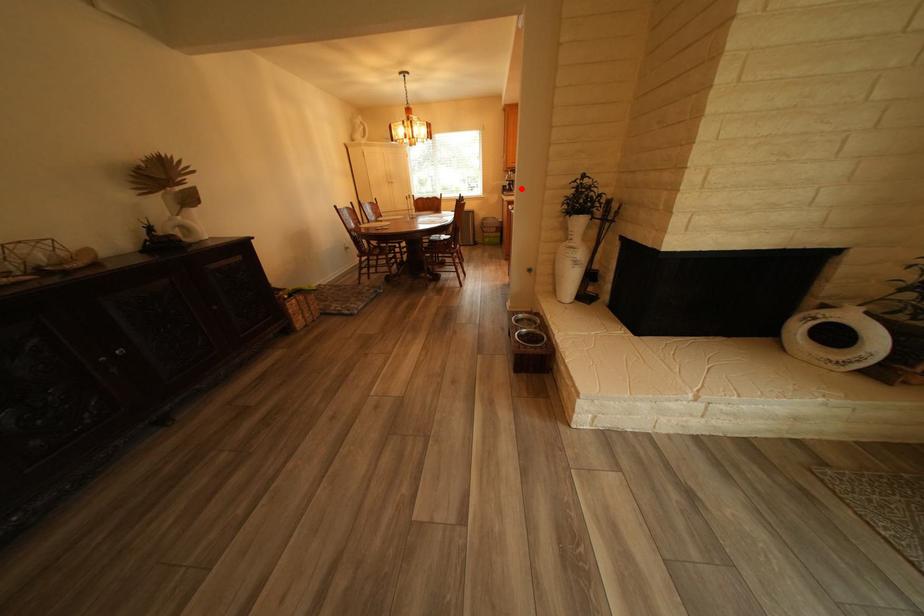
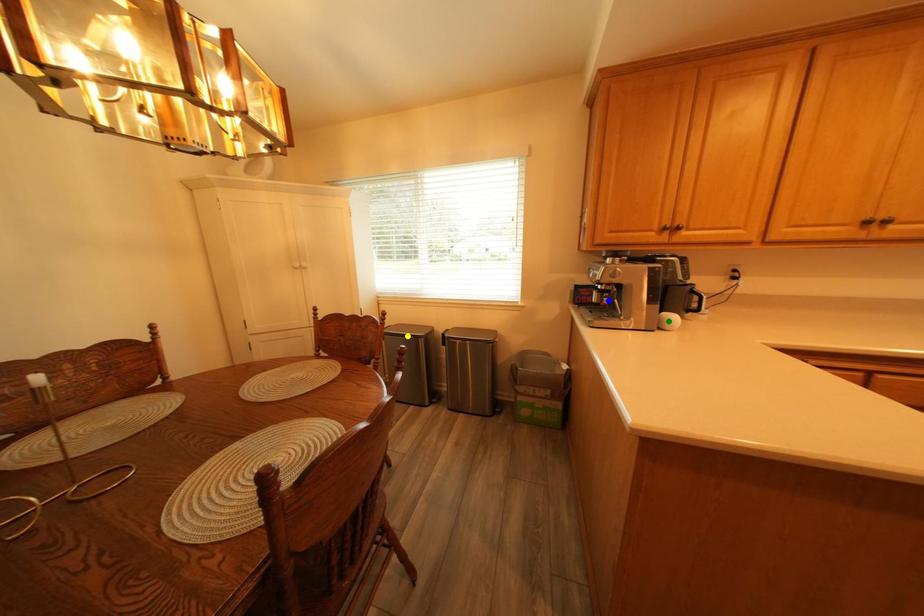
Question: I am providing you with two images of the same scene from different viewpoints. A red point is marked on the first image. You are given multiple points on the second image. Which point in image 2 represents the same 3d spot as the red point in image 1?

Choices:
 (A) yellow point
 (B) blue point
 (C) green point

Answer: (B)